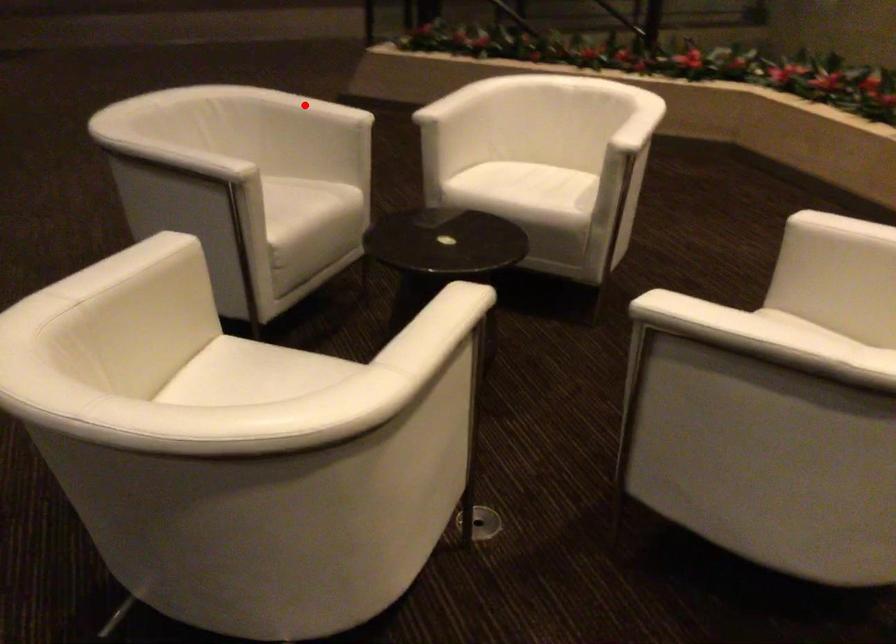
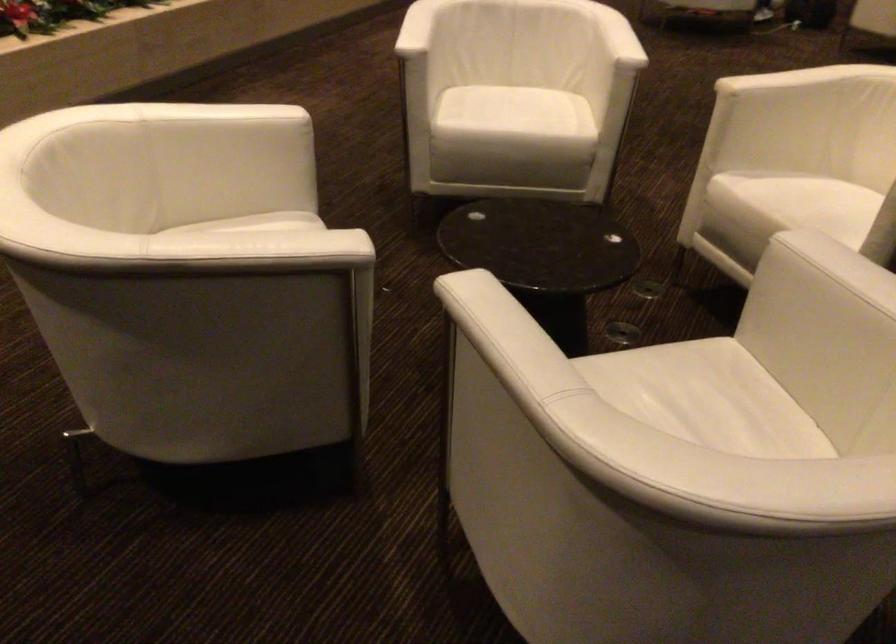
The point at the highlighted location is marked in the first image. Where is the corresponding point in the second image?

(494, 322)